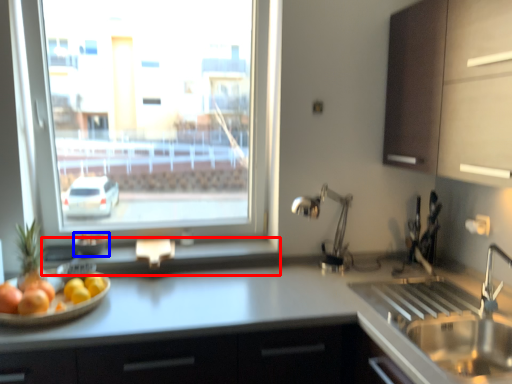
Question: Which object is closer to the camera taking this photo, window sill (highlighted by a red box) or glass bowl (highlighted by a blue box)?

Choices:
 (A) window sill
 (B) glass bowl

Answer: (A)